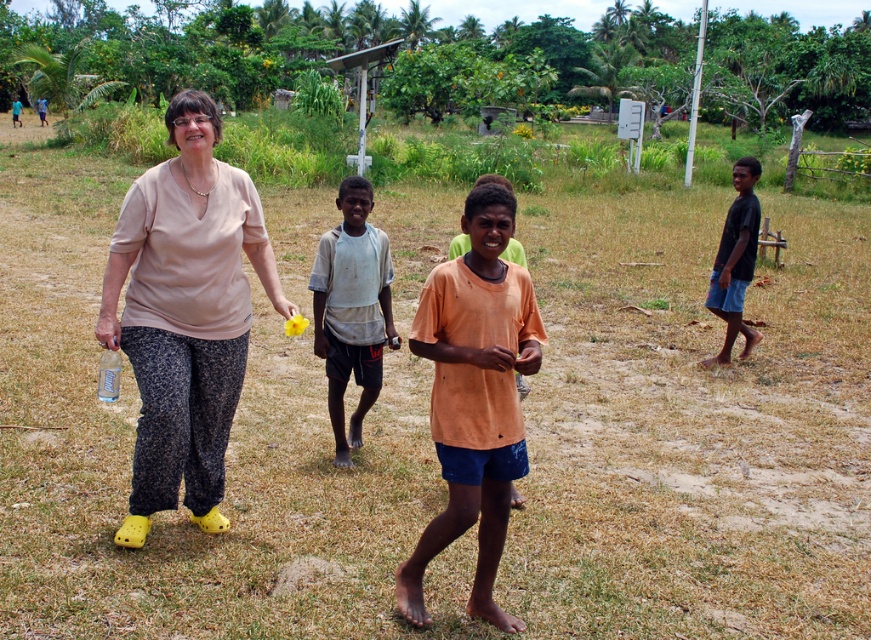
Question: Does beige fabric shirt at center have a larger size compared to dark blue shorts at right?

Choices:
 (A) no
 (B) yes

Answer: (A)

Question: Which is farther from the white cotton shirt at center?

Choices:
 (A) orange matte shirt at center
 (B) dark blue shorts at right

Answer: (B)

Question: Based on their relative distances, which object is farther from the orange matte shirt at center?

Choices:
 (A) dark blue shorts at right
 (B) white cotton shirt at center
 (C) beige fabric shirt at center

Answer: (A)

Question: Which point is farther to the camera?

Choices:
 (A) (743, 253)
 (B) (147, 275)
 (C) (382, 284)
 (D) (440, 384)

Answer: (A)

Question: Does white cotton shirt at center appear over dark blue shorts at right?

Choices:
 (A) yes
 (B) no

Answer: (B)

Question: Is beige fabric shirt at center thinner than dark blue shorts at right?

Choices:
 (A) no
 (B) yes

Answer: (B)